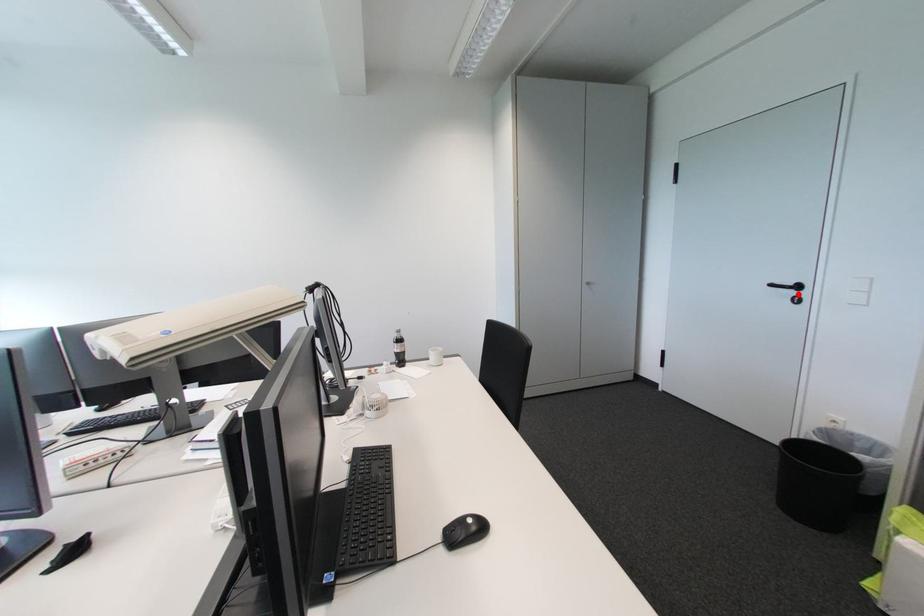
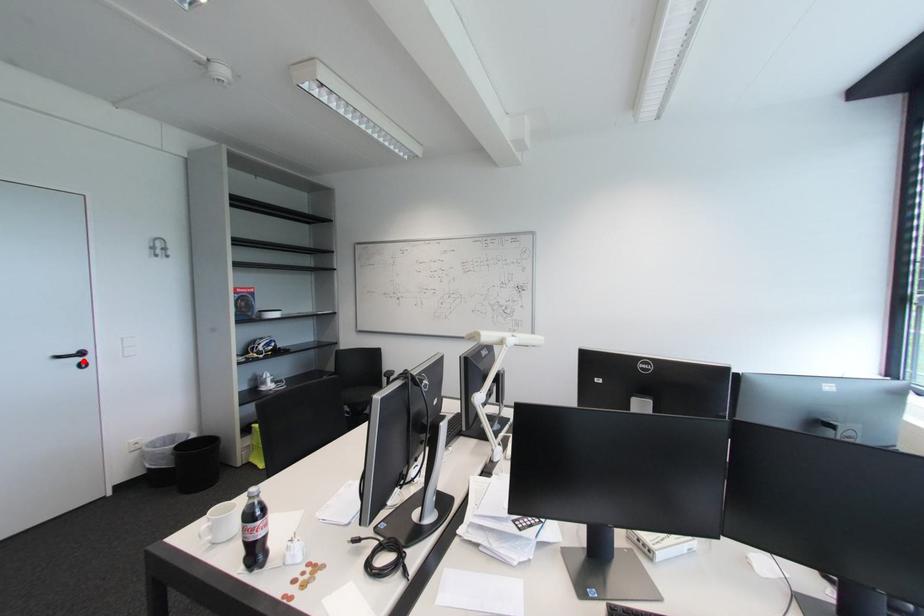
I am providing you with two images of the same scene from different viewpoints. A red point is marked on the first image and another point is marked on the second image. Do the highlighted points in image1 and image2 indicate the same real-world spot?

Yes